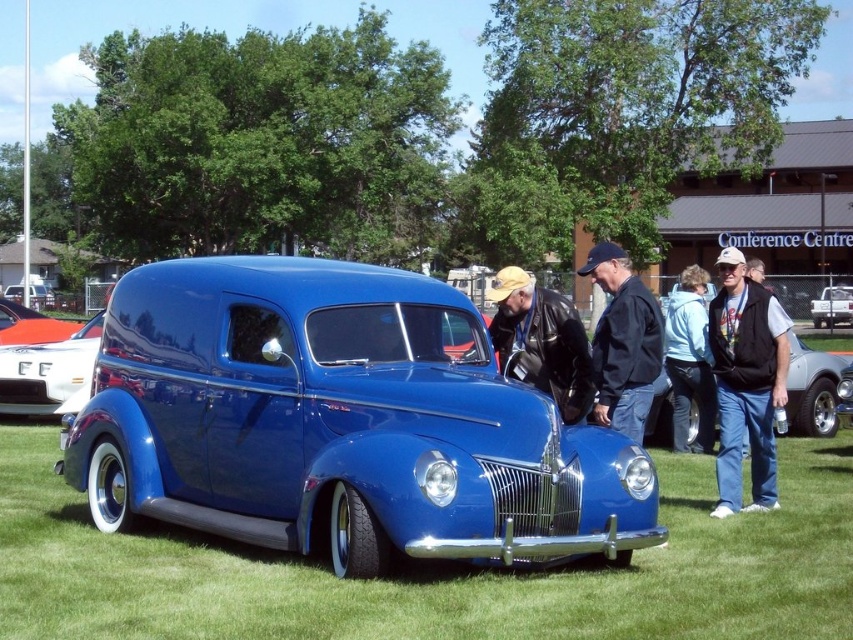
You are organizing a vintage car show and need to arrange the attendees based on their clothing sizes. You see the black vest at right and the black leather jacket at center. Which clothing item is bigger in size?

The black vest at right has a larger size compared to the black leather jacket at center.

You are a photographer trying to capture both the black vest at right and the orange glossy car at center in a single frame. Based on their sizes, which object should you focus on first to ensure both are in the frame?

The black vest at right has a lesser width compared to the orange glossy car at center, so you should focus on the orange glossy car at center first to ensure both fit within the frame.

Looking at this image, you are a photographer setting up a tripod in the green grass at center. You want to capture the shiny blue van at center in your shot without any obstructions. Since the van is to your left, which direction should you move your tripod to include the van in the frame?

The shiny blue van at center is positioned on the left side of green grass at center. To include the van in your shot, you should move your tripod to the left towards the van.